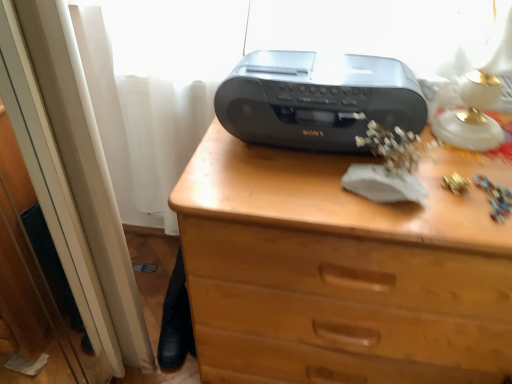
Question: Is brown wooden chest of drawers at center bigger than white glossy table lamp at upper right?

Choices:
 (A) yes
 (B) no

Answer: (A)

Question: Are brown wooden chest of drawers at center and white glossy table lamp at upper right located far from each other?

Choices:
 (A) no
 (B) yes

Answer: (A)

Question: Is white glossy table lamp at upper right surrounded by brown wooden chest of drawers at center?

Choices:
 (A) yes
 (B) no

Answer: (B)

Question: From the image's perspective, is brown wooden chest of drawers at center located beneath white glossy table lamp at upper right?

Choices:
 (A) yes
 (B) no

Answer: (A)

Question: Can you confirm if brown wooden chest of drawers at center is wider than white glossy table lamp at upper right?

Choices:
 (A) no
 (B) yes

Answer: (B)

Question: Is brown wooden chest of drawers at center thinner than white glossy table lamp at upper right?

Choices:
 (A) no
 (B) yes

Answer: (A)

Question: From a real-world perspective, does satin black radio at center sit lower than brown wooden chest of drawers at center?

Choices:
 (A) no
 (B) yes

Answer: (A)

Question: Is satin black radio at center at the right side of brown wooden chest of drawers at center?

Choices:
 (A) no
 (B) yes

Answer: (A)

Question: Is satin black radio at center looking in the opposite direction of brown wooden chest of drawers at center?

Choices:
 (A) yes
 (B) no

Answer: (B)

Question: Is satin black radio at center not inside brown wooden chest of drawers at center?

Choices:
 (A) no
 (B) yes

Answer: (B)

Question: Is satin black radio at center smaller than brown wooden chest of drawers at center?

Choices:
 (A) yes
 (B) no

Answer: (A)

Question: Considering the relative sizes of satin black radio at center and brown wooden chest of drawers at center in the image provided, is satin black radio at center shorter than brown wooden chest of drawers at center?

Choices:
 (A) yes
 (B) no

Answer: (A)

Question: Is the depth of white glossy table lamp at upper right greater than that of satin black radio at center?

Choices:
 (A) no
 (B) yes

Answer: (A)